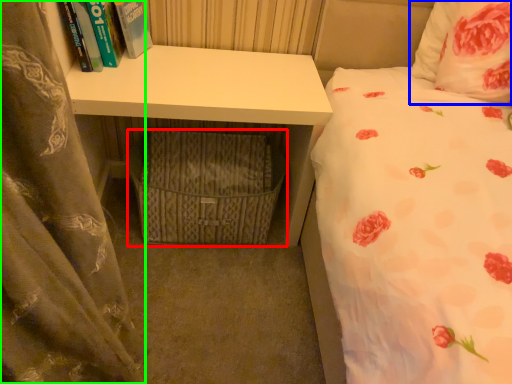
Question: Which object is the closest to the crate (highlighted by a red box)? Choose among these: pillow (highlighted by a blue box) or curtain (highlighted by a green box).

Choices:
 (A) pillow
 (B) curtain

Answer: (B)